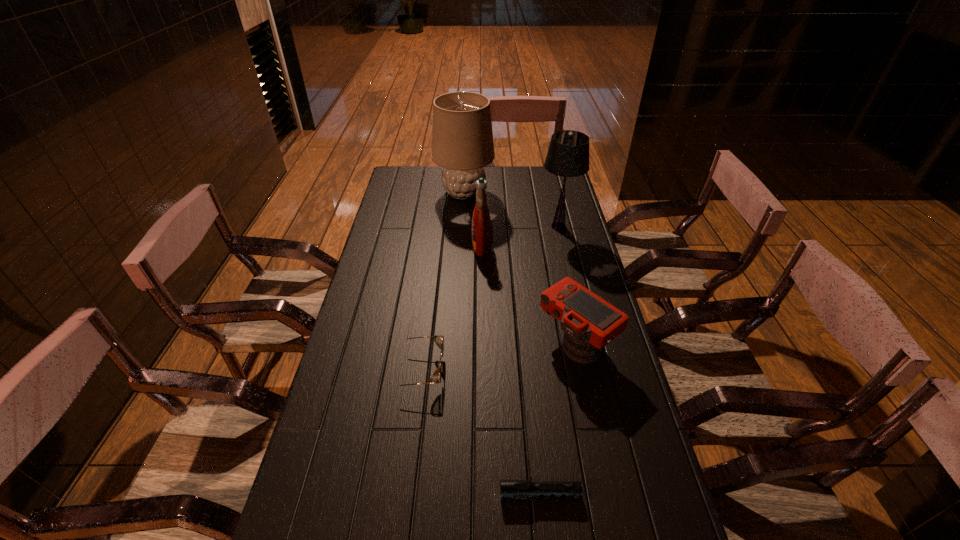
The width and height of the screenshot is (960, 540). What are the coordinates of `object at the far edge` in the screenshot? It's located at (462, 139).

You are a GUI agent. You are given a task and a screenshot of the screen. Output one action in this format:
    pyautogui.click(x=<x>, y=<y>)
    Task: Click on the object present at the left edge
    Image resolution: width=960 pixels, height=540 pixels.
    Given the screenshot: What is the action you would take?
    pyautogui.click(x=439, y=339)

Where is `lampshade situated at the right edge`? This screenshot has height=540, width=960. lampshade situated at the right edge is located at coordinates (568, 154).

Find the location of a particular element. camera at the right edge is located at coordinates (590, 323).

Where is `free space at the far edge of the desktop`? Image resolution: width=960 pixels, height=540 pixels. free space at the far edge of the desktop is located at coordinates pos(519,176).

You are a GUI agent. You are given a task and a screenshot of the screen. Output one action in this format:
    pyautogui.click(x=<x>, y=<y>)
    Task: Click on the vacant space at the left edge of the desktop
    The image size is (960, 540).
    Given the screenshot: What is the action you would take?
    pyautogui.click(x=396, y=337)

Locate an element on the screen. The image size is (960, 540). free space at the right edge of the desktop is located at coordinates (566, 254).

Where is `free space at the far left corner`? This screenshot has width=960, height=540. free space at the far left corner is located at coordinates (417, 184).

The height and width of the screenshot is (540, 960). I want to click on vacant area that lies between the second shortest object and the farthest object, so click(x=441, y=281).

Where is `blank region between the fifth tallest object and the right lampshade`? The image size is (960, 540). blank region between the fifth tallest object and the right lampshade is located at coordinates (488, 298).